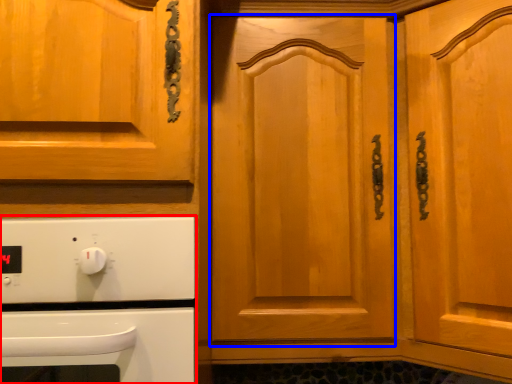
Question: Which object appears farthest to the camera in this image, home appliance (highlighted by a red box) or door (highlighted by a blue box)?

Choices:
 (A) home appliance
 (B) door

Answer: (B)